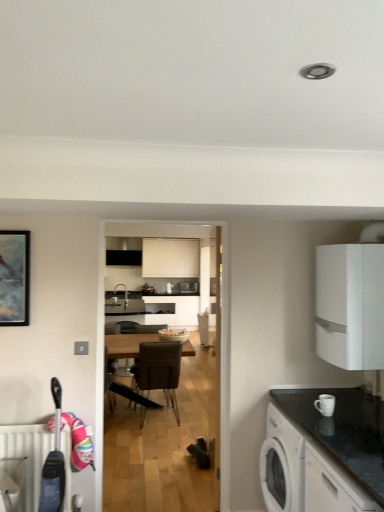
Question: From a real-world perspective, is white matte cabinet at lower right, the 1th cabinetry in the bottom-to-top sequence, over brown leather chair at center?

Choices:
 (A) no
 (B) yes

Answer: (B)

Question: Is white matte cabinet at lower right, placed as the 1th cabinetry when sorted from front to back, taller than brown leather chair at center?

Choices:
 (A) yes
 (B) no

Answer: (B)

Question: Does white matte cabinet at lower right, the 1th cabinetry in the bottom-to-top sequence, appear on the right side of brown leather chair at center?

Choices:
 (A) yes
 (B) no

Answer: (A)

Question: Considering the relative sizes of white matte cabinet at lower right, placed as the 2th cabinetry when sorted from back to front, and brown leather chair at center in the image provided, is white matte cabinet at lower right, placed as the 2th cabinetry when sorted from back to front, wider than brown leather chair at center?

Choices:
 (A) no
 (B) yes

Answer: (A)

Question: From the image's perspective, does white matte cabinet at lower right, placed as the 1th cabinetry when sorted from front to back, appear lower than brown leather chair at center?

Choices:
 (A) no
 (B) yes

Answer: (A)

Question: Considering the positions of black granite countertop at right and white matte cabinet at lower right, the 1th cabinetry in the bottom-to-top sequence, in the image, is black granite countertop at right bigger or smaller than white matte cabinet at lower right, the 1th cabinetry in the bottom-to-top sequence,?

Choices:
 (A) small
 (B) big

Answer: (A)

Question: From the image's perspective, is black granite countertop at right positioned above or below white matte cabinet at lower right, placed as the 1th cabinetry when sorted from front to back?

Choices:
 (A) below
 (B) above

Answer: (B)

Question: Considering the positions of black granite countertop at right and white matte cabinet at lower right, placed as the 1th cabinetry when sorted from front to back, in the image, is black granite countertop at right taller or shorter than white matte cabinet at lower right, placed as the 1th cabinetry when sorted from front to back,?

Choices:
 (A) short
 (B) tall

Answer: (A)

Question: Is point (370, 402) closer or farther from the camera than point (319, 466)?

Choices:
 (A) farther
 (B) closer

Answer: (A)

Question: Do you think white matte cabinet at lower right, placed as the 1th cabinetry when sorted from front to back, is within white textured radiator at lower left, or outside of it?

Choices:
 (A) outside
 (B) inside

Answer: (A)

Question: Considering the positions of point (322, 471) and point (34, 483), is point (322, 471) closer or farther from the camera than point (34, 483)?

Choices:
 (A) farther
 (B) closer

Answer: (B)

Question: Relative to white textured radiator at lower left, is white matte cabinet at lower right, placed as the 2th cabinetry when sorted from back to front, in front or behind?

Choices:
 (A) behind
 (B) front

Answer: (B)

Question: From a real-world perspective, is white matte cabinet at lower right, marked as the second cabinetry in a top-to-bottom arrangement, positioned above or below white textured radiator at lower left?

Choices:
 (A) above
 (B) below

Answer: (A)

Question: Would you say white matte cabinet at right, which ranks as the 2th cabinetry in front-to-back order, is to the left or to the right of matte white bowl at center in the picture?

Choices:
 (A) left
 (B) right

Answer: (B)

Question: Is white matte cabinet at right, the second cabinetry positioned from the bottom, wider or thinner than matte white bowl at center?

Choices:
 (A) wide
 (B) thin

Answer: (A)